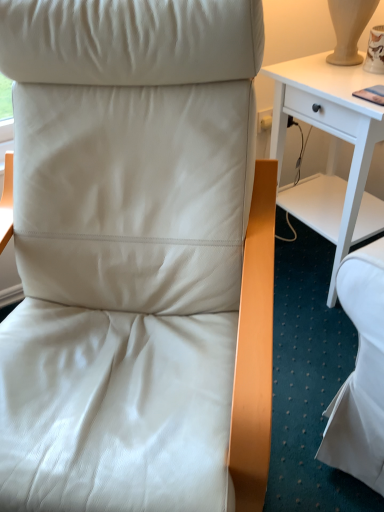
The height and width of the screenshot is (512, 384). I want to click on white wood desk at center, so click(336, 140).

Describe the element at coordinates (336, 140) in the screenshot. I see `white wood desk at center` at that location.

The width and height of the screenshot is (384, 512). What do you see at coordinates (137, 258) in the screenshot? I see `matte white leather chair at center` at bounding box center [137, 258].

The height and width of the screenshot is (512, 384). Find the location of `matte white leather chair at center`. matte white leather chair at center is located at coordinates (137, 258).

What are the coordinates of `white wood desk at center` in the screenshot? It's located at (336, 140).

Which is more to the left, matte white leather chair at center or white wood desk at center?

From the viewer's perspective, matte white leather chair at center appears more on the left side.

Relative to white wood desk at center, is matte white leather chair at center in front or behind?

Visually, matte white leather chair at center is located in front of white wood desk at center.

Considering the positions of points (32, 459) and (314, 213), is point (32, 459) closer to camera compared to point (314, 213)?

Yes, point (32, 459) is closer to viewer.

From the image's perspective, would you say matte white leather chair at center is shown under white wood desk at center?

Indeed, from the image's perspective, matte white leather chair at center is shown beneath white wood desk at center.

From a real-world perspective, is matte white leather chair at center on white wood desk at center?

Yes, from a real-world perspective, matte white leather chair at center is on top of white wood desk at center.

Which of these two, matte white leather chair at center or white wood desk at center, is wider?

matte white leather chair at center is wider.

Between matte white leather chair at center and white wood desk at center, which one has more height?

matte white leather chair at center.

Between matte white leather chair at center and white wood desk at center, which one has smaller size?

With smaller size is white wood desk at center.

In the scene shown: Is matte white leather chair at center positioned beyond the bounds of white wood desk at center?

Yes, matte white leather chair at center is outside of white wood desk at center.

Is matte white leather chair at center far from white wood desk at center?

matte white leather chair at center is near white wood desk at center, not far away.

Is matte white leather chair at center positioned with its back to white wood desk at center?

No.

At what (x,y) coordinates should I click in order to perform the action: click on desk above the matte white leather chair at center (from the image's perspective). Please return your answer as a coordinate pair (x, y). This screenshot has height=512, width=384. Looking at the image, I should click on (336, 140).

Is white wood desk at center to the right of matte white leather chair at center from the viewer's perspective?

Indeed, white wood desk at center is positioned on the right side of matte white leather chair at center.

Is white wood desk at center positioned behind matte white leather chair at center?

Yes, white wood desk at center is behind matte white leather chair at center.

Considering the positions of point (355, 137) and point (236, 104), is point (355, 137) closer or farther from the camera than point (236, 104)?

Point (355, 137) appears to be farther away from the viewer than point (236, 104).

From the image's perspective, between white wood desk at center and matte white leather chair at center, which one is located above?

white wood desk at center is shown above in the image.

Looking at this image, from a real-world perspective, is white wood desk at center located beneath matte white leather chair at center?

Yes.

Is white wood desk at center wider than matte white leather chair at center?

No, white wood desk at center is not wider than matte white leather chair at center.

Is white wood desk at center shorter than matte white leather chair at center?

Yes, white wood desk at center is shorter than matte white leather chair at center.

Does white wood desk at center have a larger size compared to matte white leather chair at center?

Incorrect, white wood desk at center is not larger than matte white leather chair at center.

Is matte white leather chair at center a part of white wood desk at center?

No, matte white leather chair at center is located outside of white wood desk at center.

Is white wood desk at center not near matte white leather chair at center?

No, white wood desk at center is not far away from matte white leather chair at center.

Is white wood desk at center oriented towards matte white leather chair at center?

Yes.

What's the angular difference between white wood desk at center and matte white leather chair at center's facing directions?

The angle between the facing direction of white wood desk at center and the facing direction of matte white leather chair at center is 47.5 degrees.

How distant is white wood desk at center from matte white leather chair at center?

They are 21.42 inches apart.

Find the location of a particular element. The width and height of the screenshot is (384, 512). desk located above the matte white leather chair at center (from the image's perspective) is located at coordinates (336, 140).

This screenshot has width=384, height=512. I want to click on desk that appears behind the matte white leather chair at center, so click(x=336, y=140).

Where is `chair on the left side of white wood desk at center`? The height and width of the screenshot is (512, 384). chair on the left side of white wood desk at center is located at coordinates [137, 258].